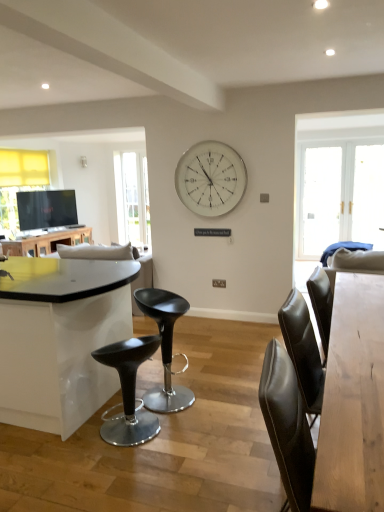
Question: Is shiny black stool at center touching black plastic stool at center?

Choices:
 (A) no
 (B) yes

Answer: (A)

Question: Is the position of shiny black stool at center less distant than that of black plastic stool at center?

Choices:
 (A) yes
 (B) no

Answer: (A)

Question: Is shiny black stool at center not within black plastic stool at center?

Choices:
 (A) yes
 (B) no

Answer: (A)

Question: Can you confirm if shiny black stool at center is thinner than black plastic stool at center?

Choices:
 (A) no
 (B) yes

Answer: (B)

Question: From the image's perspective, does shiny black stool at center appear lower than black plastic stool at center?

Choices:
 (A) no
 (B) yes

Answer: (B)

Question: Is point (211, 212) closer or farther from the camera than point (130, 251)?

Choices:
 (A) closer
 (B) farther

Answer: (B)

Question: Is white glass clock at upper center inside the boundaries of white fabric couch at center, or outside?

Choices:
 (A) inside
 (B) outside

Answer: (B)

Question: Considering their positions, is white glass clock at upper center located in front of or behind white fabric couch at center?

Choices:
 (A) behind
 (B) front

Answer: (B)

Question: Is white glass clock at upper center taller or shorter than white fabric couch at center?

Choices:
 (A) short
 (B) tall

Answer: (A)

Question: Is matte black table at left, which appears as the 2th table when viewed from the front, inside the boundaries of shiny black stool at center, or outside?

Choices:
 (A) inside
 (B) outside

Answer: (B)

Question: Considering the positions of matte black table at left, the second table from the right, and shiny black stool at center in the image, is matte black table at left, the second table from the right, taller or shorter than shiny black stool at center?

Choices:
 (A) short
 (B) tall

Answer: (A)

Question: In the image, is matte black table at left, which appears as the 2th table when viewed from the front, on the left side or the right side of shiny black stool at center?

Choices:
 (A) right
 (B) left

Answer: (B)

Question: Does point (59, 231) appear closer or farther from the camera than point (145, 426)?

Choices:
 (A) farther
 (B) closer

Answer: (A)

Question: Would you say light brown wooden table at right, the first table when ordered from right to left, is to the left or to the right of shiny black stool at center in the picture?

Choices:
 (A) right
 (B) left

Answer: (A)

Question: From a real-world perspective, relative to shiny black stool at center, is light brown wooden table at right, placed as the first table when sorted from front to back, vertically above or below?

Choices:
 (A) below
 (B) above

Answer: (B)